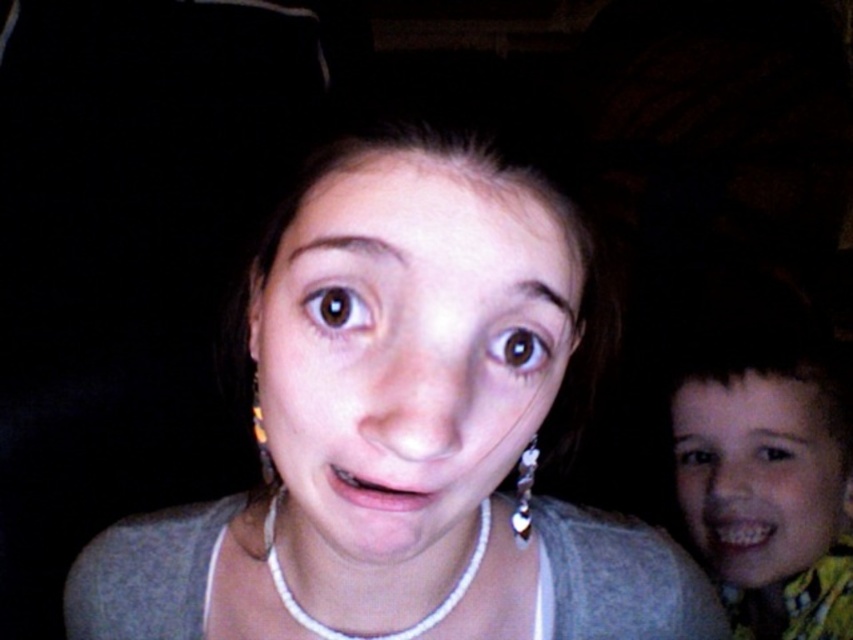
Is brown shiny eye at center below brown shiny eye at upper center?

No, brown shiny eye at center is not below brown shiny eye at upper center.

Is brown shiny eye at center smaller than brown shiny eye at upper center?

Correct, brown shiny eye at center occupies less space than brown shiny eye at upper center.

Describe the element at coordinates (335, 308) in the screenshot. I see `brown shiny eye at center` at that location.

Where is `brown shiny eye at center`? Image resolution: width=853 pixels, height=640 pixels. brown shiny eye at center is located at coordinates (335, 308).

Can you confirm if gray fabric at center is taller than brown shiny eye at center?

Indeed, gray fabric at center has a greater height compared to brown shiny eye at center.

Is gray fabric at center further to camera compared to brown shiny eye at center?

No, gray fabric at center is in front of brown shiny eye at center.

Between point (293, 481) and point (328, 332), which one is positioned behind?

Point (293, 481)

This screenshot has height=640, width=853. I want to click on gray fabric at center, so click(x=405, y=420).

Between point (529, 243) and point (256, 401), which one is positioned behind?

The point (256, 401) is behind.

Who is taller, smooth skin face at center or yellow plastic earring at left?

With more height is smooth skin face at center.

Who is more forward, (x=502, y=234) or (x=254, y=408)?

Point (x=502, y=234) is in front.

The width and height of the screenshot is (853, 640). Find the location of `smooth skin face at center`. smooth skin face at center is located at coordinates (405, 352).